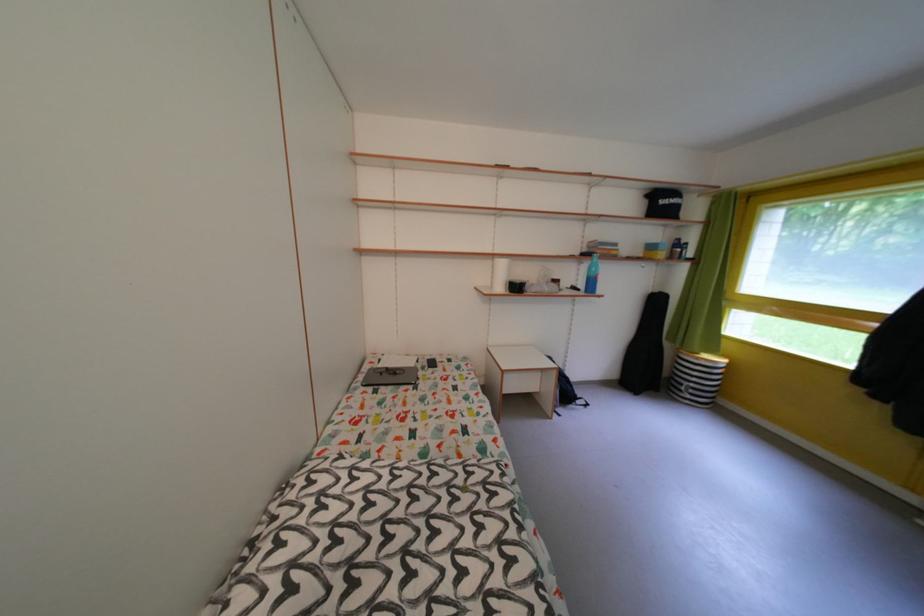
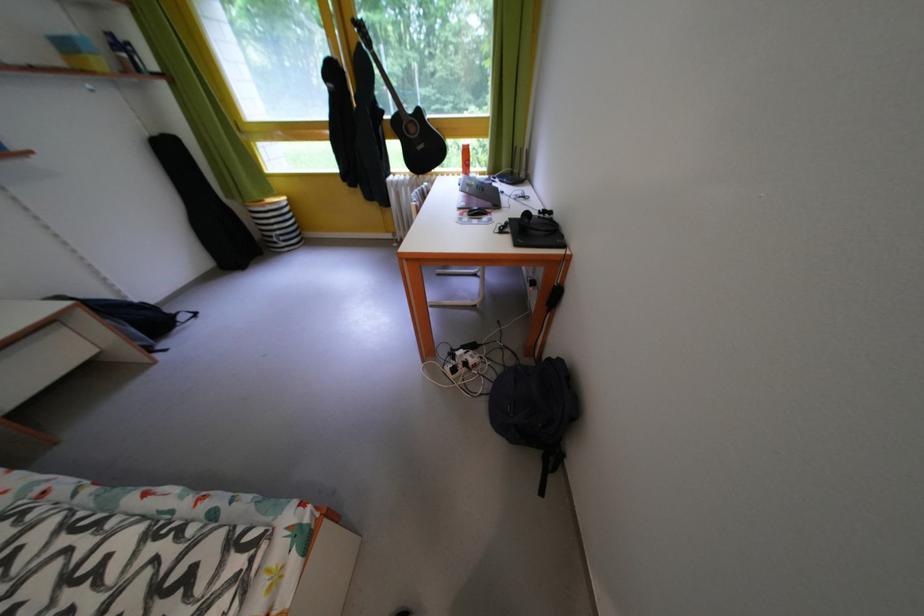
In the second image, find the point that corresponds to (700,391) in the first image.

(287, 238)